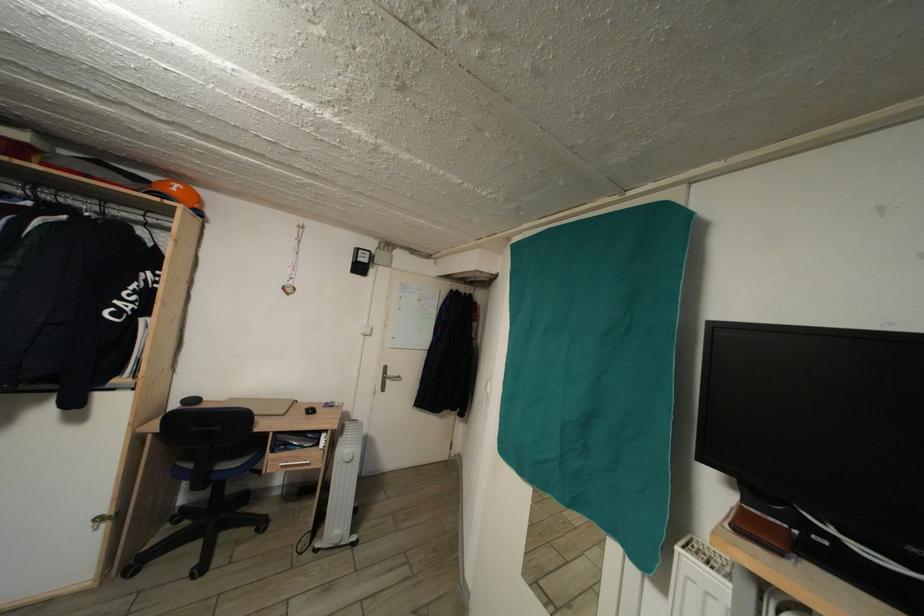
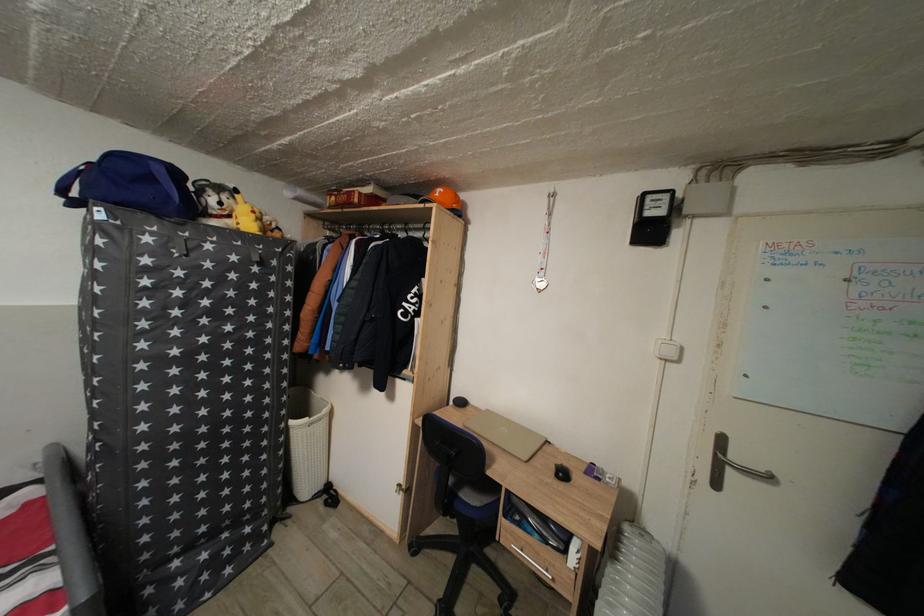
Question: Based on the continuous images, in which direction is the camera rotating? Reply with the corresponding letter.

Choices:
 (A) Left
 (B) Right
 (C) Up
 (D) Down

Answer: (A)